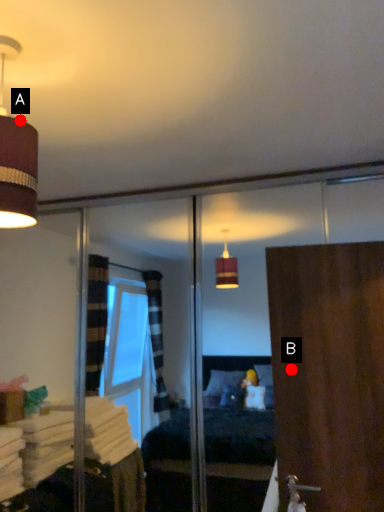
Question: Two points are circled on the image, labeled by A and B beside each circle. Which point is closer to the camera taking this photo?

Choices:
 (A) A is closer
 (B) B is closer

Answer: (A)